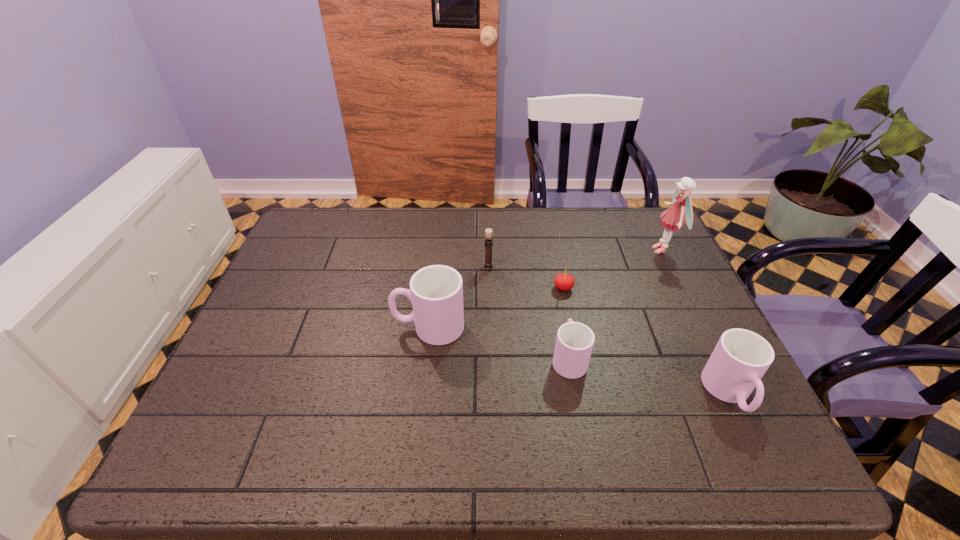
Identify the location of free space at the near right corner of the desktop. The width and height of the screenshot is (960, 540). (688, 407).

Where is `empty location between the third farthest object and the doll`? Image resolution: width=960 pixels, height=540 pixels. empty location between the third farthest object and the doll is located at coordinates (613, 269).

The image size is (960, 540). Identify the location of vacant region between the second shortest cup and the tallest object. (696, 322).

Identify the location of empty space that is in between the candle holder and the doll. (576, 258).

This screenshot has height=540, width=960. Find the location of `vacant space that's between the second cup from left to right and the tallest object`. vacant space that's between the second cup from left to right and the tallest object is located at coordinates (615, 304).

The width and height of the screenshot is (960, 540). Identify the location of free space between the third farthest object and the fifth object from right to left. (x=526, y=278).

Identify the location of vacant region between the candle holder and the cherry. The width and height of the screenshot is (960, 540). (526, 278).

Locate an element on the screen. vacant space that is in between the rightmost cup and the candle holder is located at coordinates (609, 330).

Select which object appears as the closest to the candle holder. Please provide its 2D coordinates. Your answer should be formatted as a tuple, i.e. [(x, y)], where the tuple contains the x and y coordinates of a point satisfying the conditions above.

[(436, 292)]

Find the location of `the fourth closest object relative to the cherry`. the fourth closest object relative to the cherry is located at coordinates (673, 218).